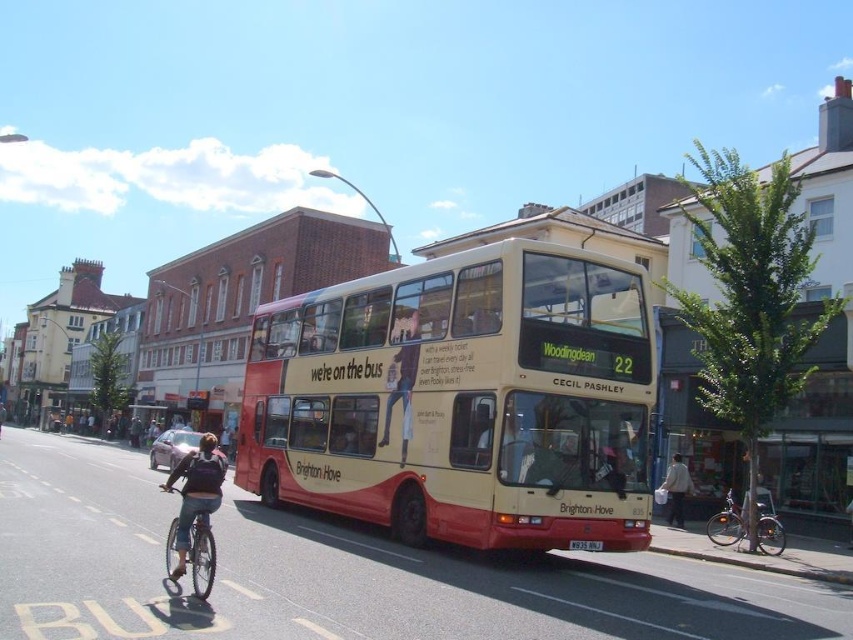
Question: Observing the image, what is the correct spatial positioning of beige/yellow painted decker bus at center in reference to white cotton shirt at center?

Choices:
 (A) below
 (B) above

Answer: (B)

Question: Based on their relative distances, which object is farther from the beige/yellow painted decker bus at center?

Choices:
 (A) silver metallic bicycle at lower right
 (B) white cotton shirt at center

Answer: (B)

Question: Can you confirm if white cotton shirt at center is smaller than black plastic license plate at center?

Choices:
 (A) no
 (B) yes

Answer: (A)

Question: Which point is closer to the camera?

Choices:
 (A) (178, 492)
 (B) (509, 307)
 (C) (665, 490)

Answer: (A)

Question: Does silver metallic bicycle at lower right appear under white cotton shirt at center?

Choices:
 (A) no
 (B) yes

Answer: (A)

Question: Which object is farther from the camera taking this photo?

Choices:
 (A) beige/yellow painted decker bus at center
 (B) white cotton shirt at center

Answer: (B)